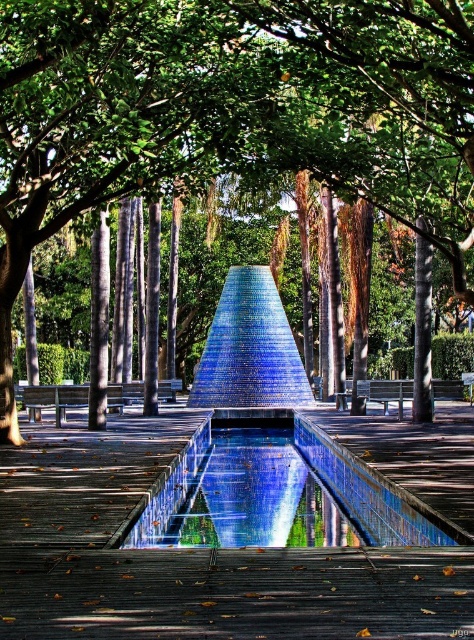
You are standing in the park and want to take a photo of the green leafy tree at center. If your camera has a maximum zoom range of 10 meters, will you need to move closer to the tree to capture it clearly?

The green leafy tree at center is 14.11 meters away from you. Since your camera can only zoom up to 10 meters, you need to move closer to the tree to capture it clearly.